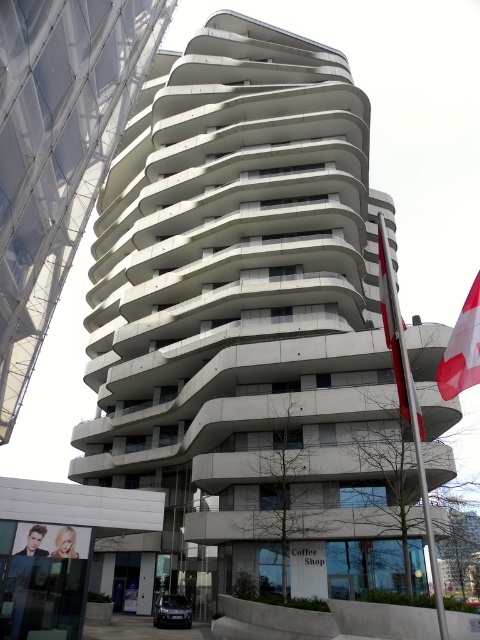
Is red fabric flag at right positioned before red and white striped flag at upper right?

No, red fabric flag at right is behind red and white striped flag at upper right.

How far apart are red fabric flag at right and red and white striped flag at upper right?

20.47 meters

Is point (477, 355) closer to camera compared to point (387, 346)?

Yes, point (477, 355) is closer to viewer.

Identify the location of red fabric flag at right. This screenshot has height=640, width=480. (462, 348).